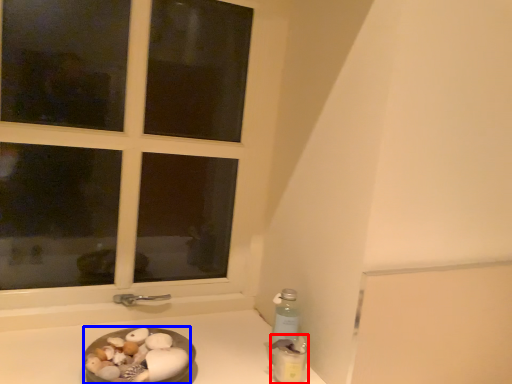
Question: Which object appears farthest to the camera in this image, bottle (highlighted by a red box) or food (highlighted by a blue box)?

Choices:
 (A) bottle
 (B) food

Answer: (A)